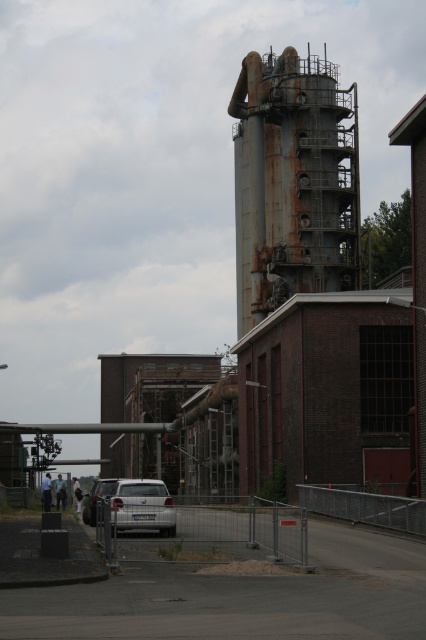
You are driving a car that is the same size as the white matte car at lower left. You want to park your car next to the rusty metal water tower at center. Will your car fit in the space next to the tower?

The rusty metal water tower at center is wider than the white matte car at lower left, so there should be enough space to park the car next to the tower since the tower itself is wider, allowing for a parking spot beside it.

You are a delivery driver who needs to park your car in the industrial area shown. You have two cars available, the satin silver car at center and the white matte car at lower left. Which car should you choose if you need a longer vehicle to fit into a narrow parking spot?

The white matte car at lower left is longer than the satin silver car at center, so it would be more suitable for fitting into a narrow parking spot.